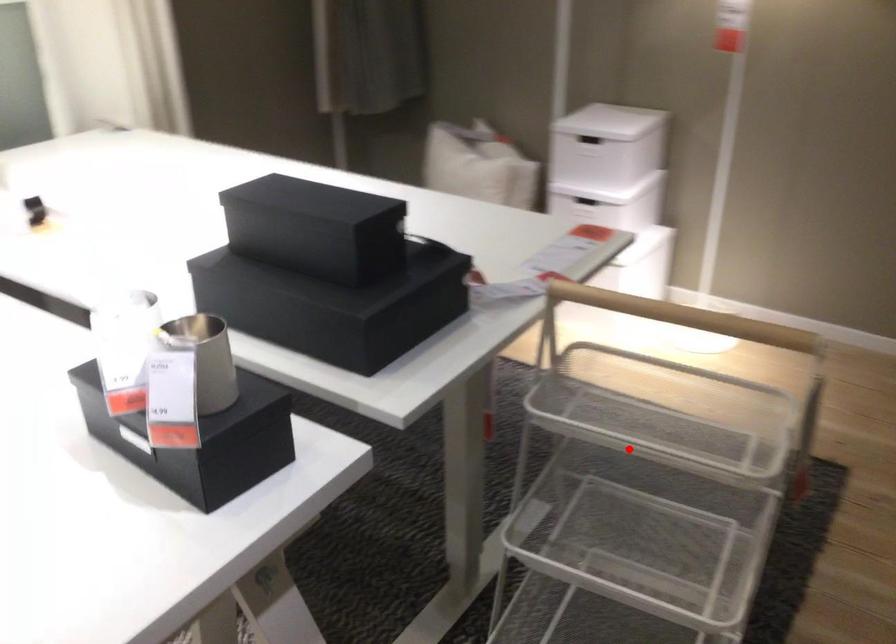
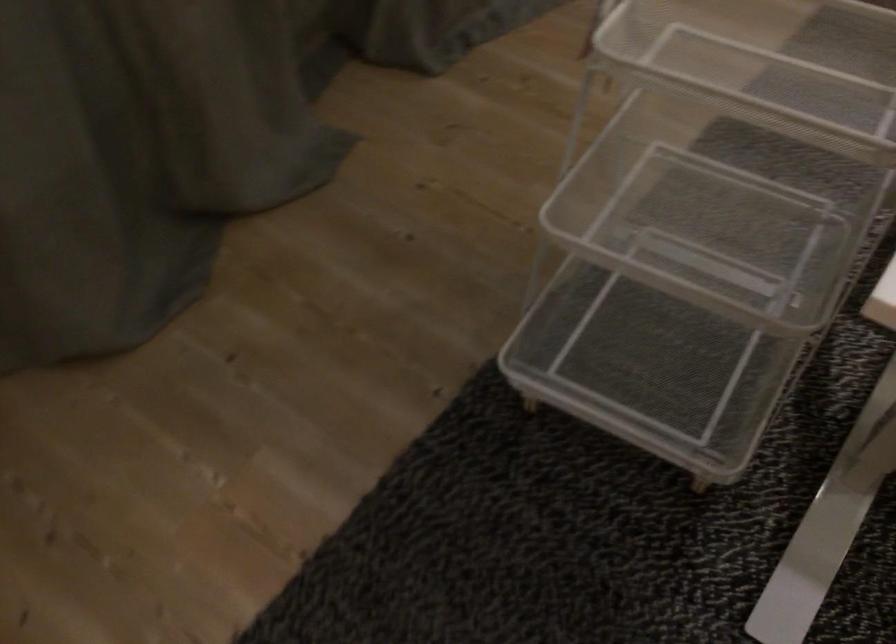
Question: A red point is marked in image1. In image2, is the corresponding 3D point closer to the camera or farther? Reply with the corresponding letter.

Choices:
 (A) The corresponding 3D point is closer.
 (B) The corresponding 3D point is farther.

Answer: (A)